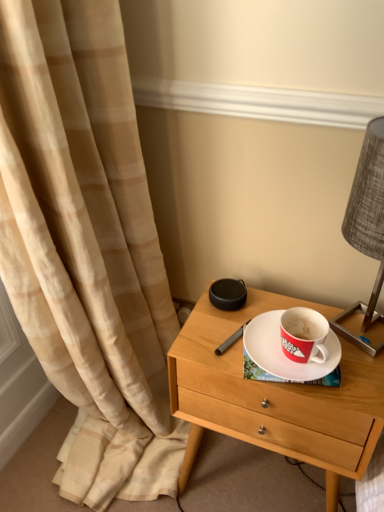
This screenshot has width=384, height=512. I want to click on vacant space to the left of white matte saucer at center, so click(x=215, y=337).